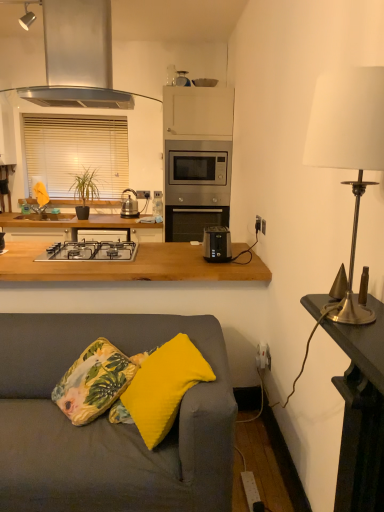
Question: Is satin silver microwave at upper center, the 2th appliance when ordered from right to left, outside of yellow fabric pillow at lower center, which is counted as the first pillow, starting from the back?

Choices:
 (A) yes
 (B) no

Answer: (A)

Question: Is satin silver microwave at upper center, which appears as the third appliance when ordered from the bottom, positioned in front of yellow fabric pillow at lower center, which is counted as the first pillow, starting from the back?

Choices:
 (A) yes
 (B) no

Answer: (B)

Question: Does satin silver microwave at upper center, the 2th appliance when ordered from right to left, have a greater height compared to yellow fabric pillow at lower center, the 2th pillow viewed from the front?

Choices:
 (A) no
 (B) yes

Answer: (A)

Question: Is satin silver microwave at upper center, the 2th appliance viewed from the back, not near yellow fabric pillow at lower center, which is counted as the first pillow, starting from the back?

Choices:
 (A) no
 (B) yes

Answer: (B)

Question: Does satin silver microwave at upper center, positioned as the first appliance in top-to-bottom order, have a lesser width compared to yellow fabric pillow at lower center, the 2th pillow viewed from the front?

Choices:
 (A) yes
 (B) no

Answer: (A)

Question: Considering the positions of stainless steel gas stove at center and gold metallic lamp at right, the 3th appliance from the back, in the image, is stainless steel gas stove at center taller or shorter than gold metallic lamp at right, the 3th appliance from the back,?

Choices:
 (A) tall
 (B) short

Answer: (B)

Question: From a real-world perspective, is stainless steel gas stove at center above or below gold metallic lamp at right, positioned as the 1th appliance in right-to-left order?

Choices:
 (A) above
 (B) below

Answer: (B)

Question: In the image, is stainless steel gas stove at center positioned in front of or behind gold metallic lamp at right, the 3th appliance from the top?

Choices:
 (A) behind
 (B) front

Answer: (A)

Question: From the image's perspective, is stainless steel gas stove at center positioned above or below gold metallic lamp at right, positioned as the 1th appliance in right-to-left order?

Choices:
 (A) above
 (B) below

Answer: (A)

Question: From the image's perspective, relative to white blinds at upper left, is yellow fabric pillow at lower left, which is the second pillow from back to front, above or below?

Choices:
 (A) above
 (B) below

Answer: (B)

Question: Visually, is yellow fabric pillow at lower left, which is the second pillow from back to front, positioned to the left or to the right of white blinds at upper left?

Choices:
 (A) left
 (B) right

Answer: (B)

Question: Is yellow fabric pillow at lower left, the 1th pillow when ordered from front to back, taller or shorter than white blinds at upper left?

Choices:
 (A) tall
 (B) short

Answer: (B)

Question: Considering the positions of yellow fabric pillow at lower left, the 1th pillow when ordered from front to back, and white blinds at upper left in the image, is yellow fabric pillow at lower left, the 1th pillow when ordered from front to back, wider or thinner than white blinds at upper left?

Choices:
 (A) wide
 (B) thin

Answer: (A)

Question: From a real-world perspective, is green matte plant at left positioned above or below yellow fabric pillow at lower center, which is counted as the first pillow, starting from the back?

Choices:
 (A) above
 (B) below

Answer: (A)

Question: Is green matte plant at left bigger or smaller than yellow fabric pillow at lower center, the 2th pillow viewed from the front?

Choices:
 (A) small
 (B) big

Answer: (B)